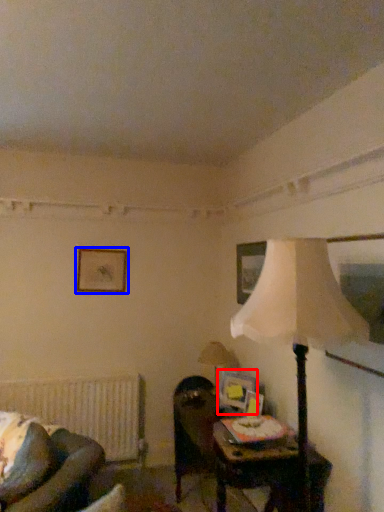
Question: Among these objects, which one is nearest to the camera, picture frame (highlighted by a red box) or picture frame (highlighted by a blue box)?

Choices:
 (A) picture frame
 (B) picture frame

Answer: (A)